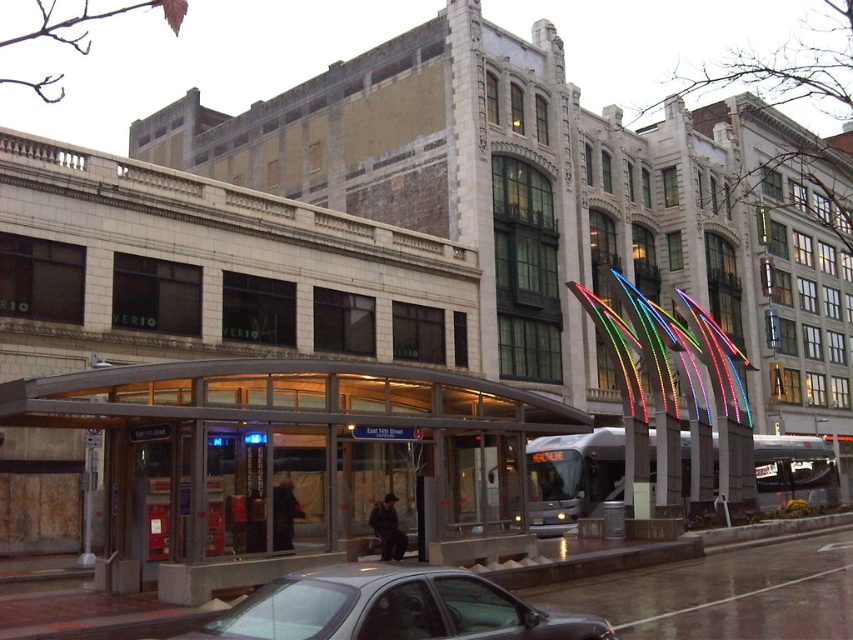
Question: Estimate the real-world distances between objects in this image. Which object is farther from the translucent glass bus stop at center?

Choices:
 (A) metallic gray sedan at lower center
 (B) neon lights at center

Answer: (B)

Question: Which point is farther from the camera taking this photo?

Choices:
 (A) (601, 636)
 (B) (706, 436)

Answer: (B)

Question: Does translucent glass bus stop at center lie behind neon lights at center?

Choices:
 (A) yes
 (B) no

Answer: (B)

Question: Estimate the real-world distances between objects in this image. Which object is farther from the translucent glass bus stop at center?

Choices:
 (A) metallic gray sedan at lower center
 (B) neon lights at center

Answer: (B)

Question: Where is translucent glass bus stop at center located in relation to metallic gray sedan at lower center in the image?

Choices:
 (A) below
 (B) above

Answer: (B)

Question: Is neon lights at center below metallic gray sedan at lower center?

Choices:
 (A) no
 (B) yes

Answer: (A)